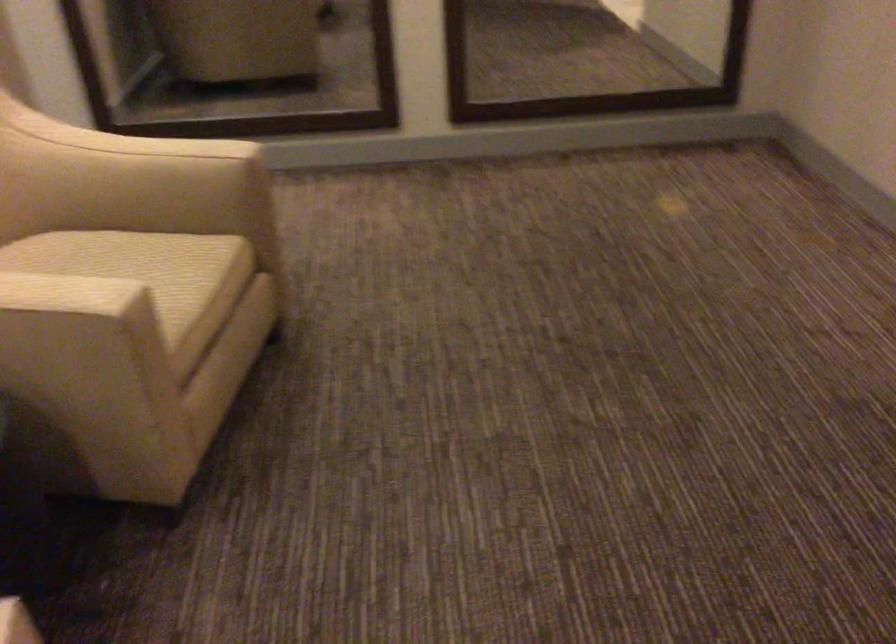
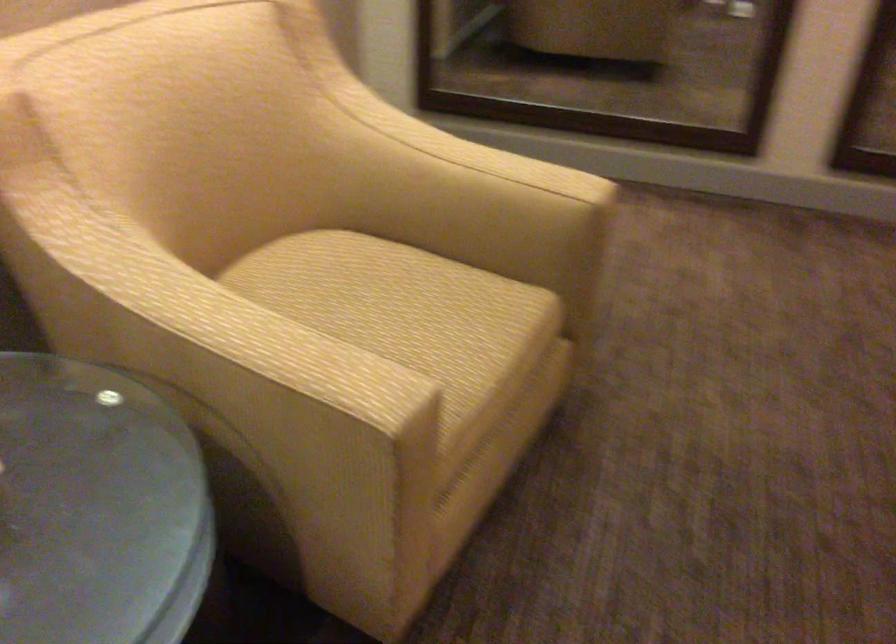
Question: The first image is from the beginning of the video and the second image is from the end. How did the camera likely rotate when shooting the video?

Choices:
 (A) Left
 (B) Right
 (C) Up
 (D) Down

Answer: (A)